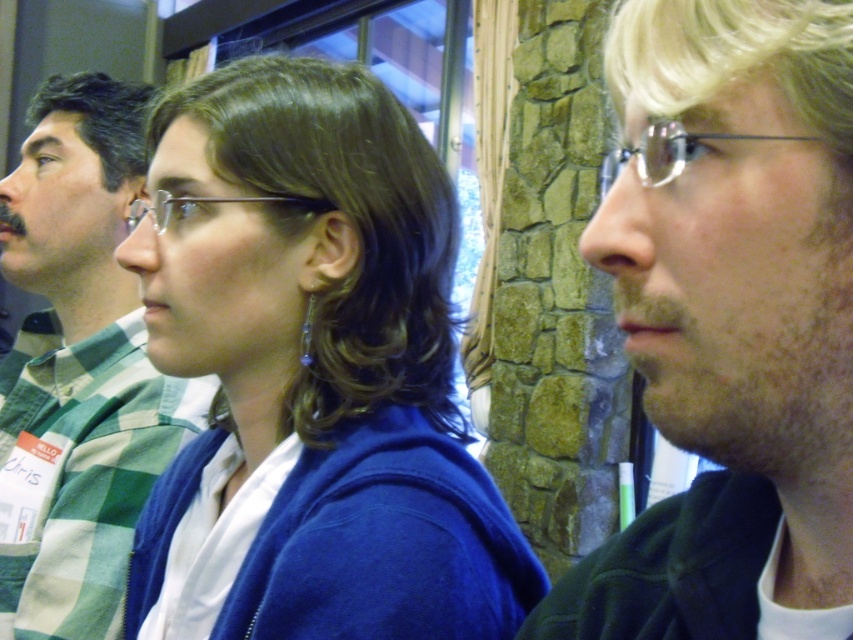
You are organizing a group photo and need to ensure that the blue matte sweater at center and the blonde hair at right are visible in the frame. Based on their widths, which one requires more horizontal space to fully capture in the photo?

The blue matte sweater at center requires more horizontal space because its width surpasses that of the blonde hair at right.

You are a photographer setting up for a group photo. You need to ensure that the blue matte sweater at center and the blonde hair at right are both visible in the frame. Based on their heights, which one might require you to adjust the camera angle upwards to capture their full figure?

The blue matte sweater at center is taller than the blonde hair at right, so you would need to adjust the camera angle upwards to capture the full figure of the blue matte sweater at center.